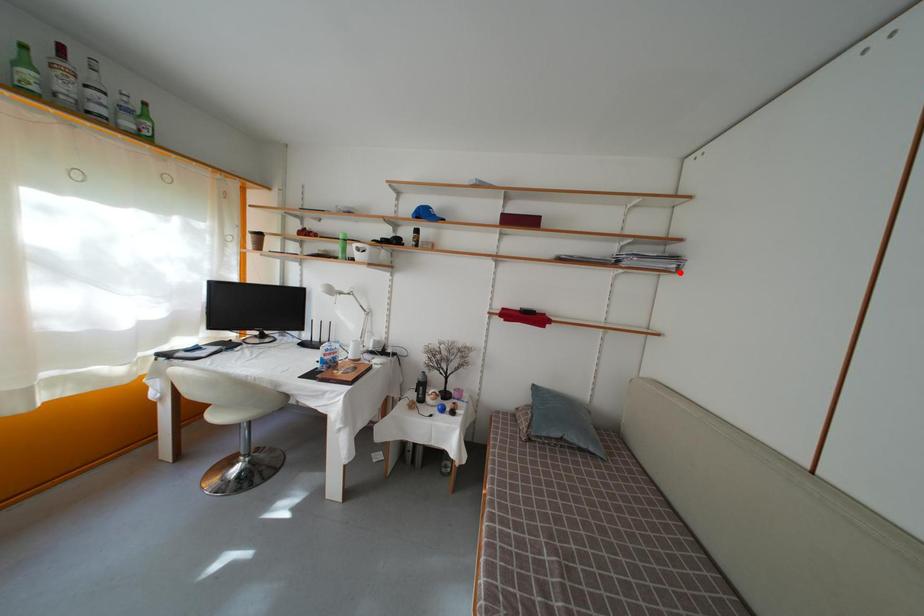
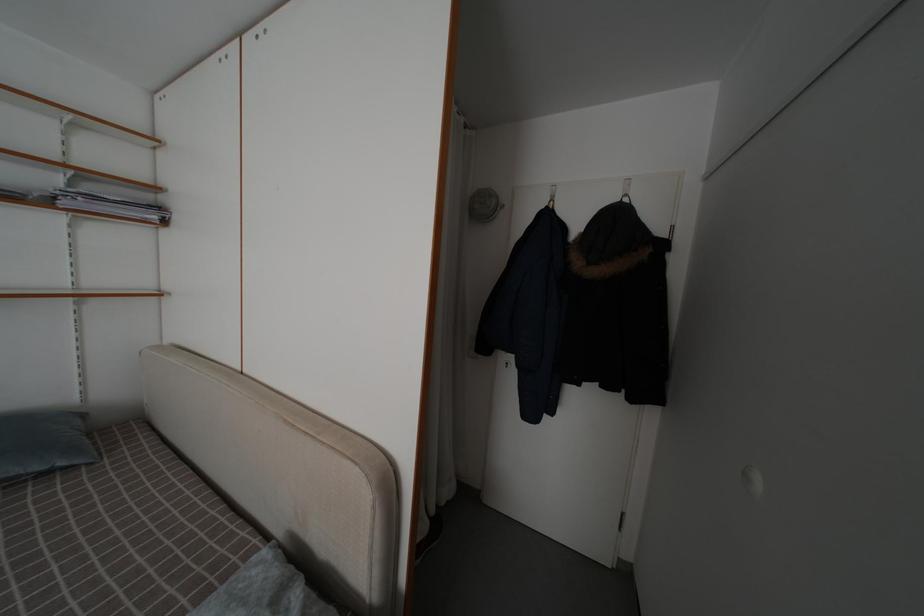
The point at the highlighted location is marked in the first image. Where is the corresponding point in the second image?

(161, 224)